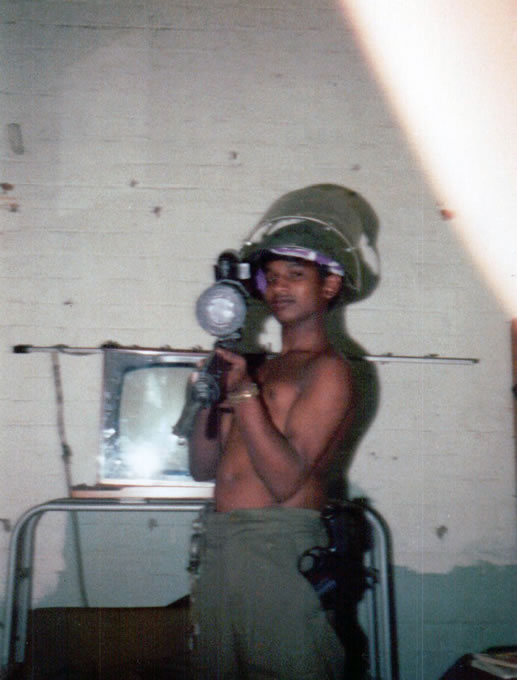
This screenshot has width=517, height=680. I want to click on tile wall, so click(x=201, y=92).